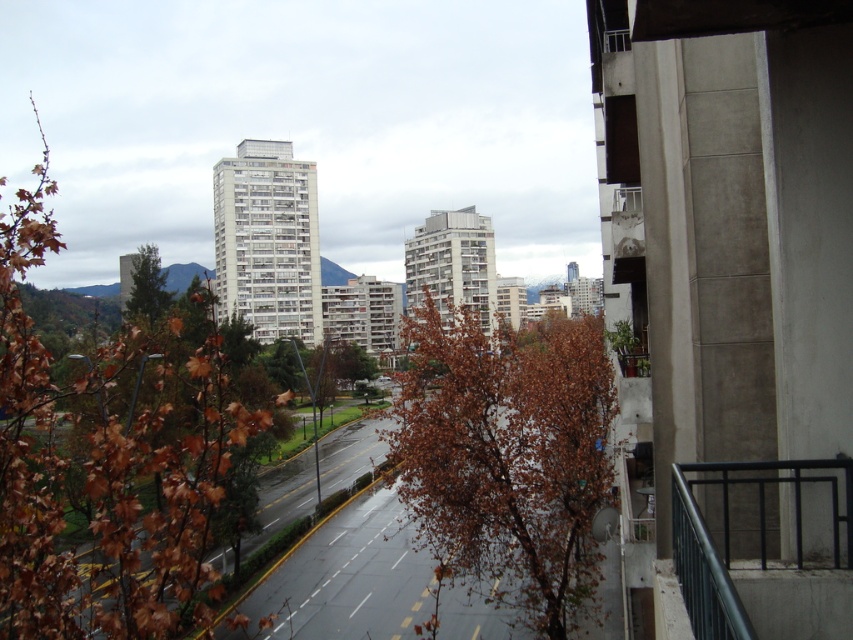
You are standing on a balcony overlooking the city and see the brown leafy tree at center and the green leafy tree at left. Which tree is closer to the left side of your view?

The green leafy tree at left is closer to the left side of the view because it is positioned on the left side of the brown leafy tree at center.

You are standing on a balcony overlooking the city. You notice a brown leafy tree at center and a green leafy tree at left. Which tree would appear narrower from your viewpoint?

The brown leafy tree at center has a lesser width compared to the green leafy tree at left, so it would appear narrower from your viewpoint.